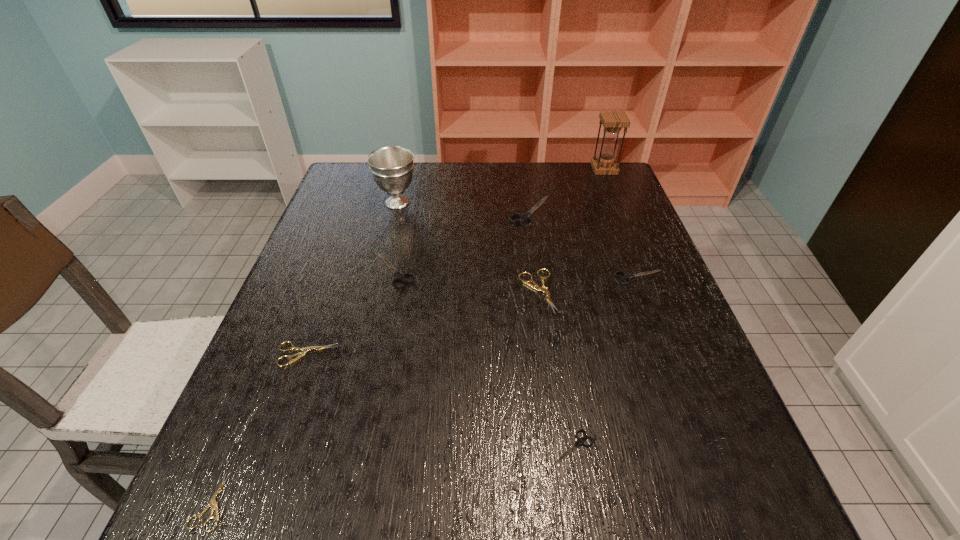
You are a GUI agent. You are given a task and a screenshot of the screen. Output one action in this format:
    pyautogui.click(x=<x>, y=<y>)
    Task: Click on the hourglass
    Image resolution: width=960 pixels, height=540 pixels.
    Given the screenshot: What is the action you would take?
    pyautogui.click(x=613, y=121)

This screenshot has width=960, height=540. Identify the location of the farthest object. (613, 121).

Locate an element on the screen. the eighth shortest object is located at coordinates (392, 167).

Identify the location of the third tallest object. This screenshot has height=540, width=960. (524, 217).

Image resolution: width=960 pixels, height=540 pixels. Identify the location of the biggest black shears. (524, 217).

Identify the location of the second tallest shears. (399, 276).

This screenshot has width=960, height=540. Find the location of `the fifth shears from right to left`. the fifth shears from right to left is located at coordinates (399, 276).

Find the location of a particular element. The width and height of the screenshot is (960, 540). the second smallest black shears is located at coordinates pos(626,276).

The image size is (960, 540). Find the location of `the rightmost shears`. the rightmost shears is located at coordinates (626, 276).

Locate an element on the screen. The image size is (960, 540). the biggest beige shears is located at coordinates (535, 286).